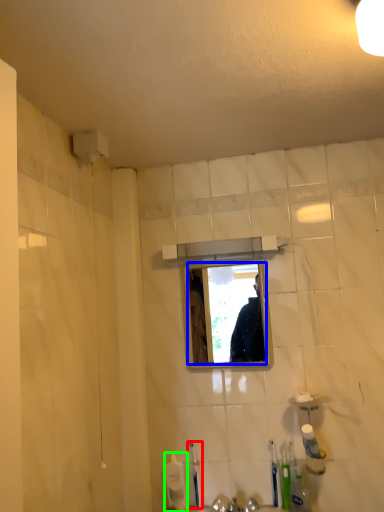
Question: Considering the real-world distances, which object is farthest from toothbrush (highlighted by a red box)? mirror (highlighted by a blue box) or toiletry (highlighted by a green box)?

Choices:
 (A) mirror
 (B) toiletry

Answer: (A)